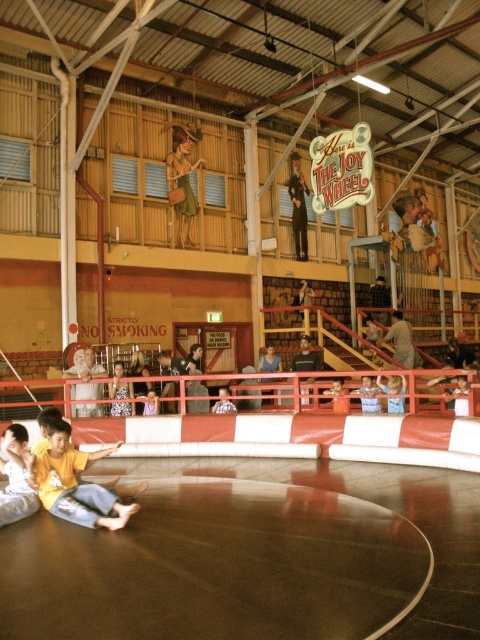
You are standing at the entrance of The Joy Wheel venue. You want to locate the metallic gold statue at upper center. According to the coordinates provided, where should you look to find it?

The metallic gold statue at upper center is located at coordinates point (298, 205).

You are standing at the entrance of The Joy Wheel venue and want to take a photo of the metallic gold statue at upper center. The camera you are using has a maximum zoom range of 50 feet. Can you capture the statue clearly without moving closer?

The metallic gold statue at upper center and camera are 57.82 feet apart from each other. Since the camera can only zoom up to 50 feet, you cannot capture the statue clearly without moving closer.

You are standing at the entrance of The Joy Wheel venue and see the point marked as point (75, 483). Is this point closer to the entrance or the exit?

The point marked as point (75, 483) is located at the lower left area of the venue, which is closer to the entrance than the exit.